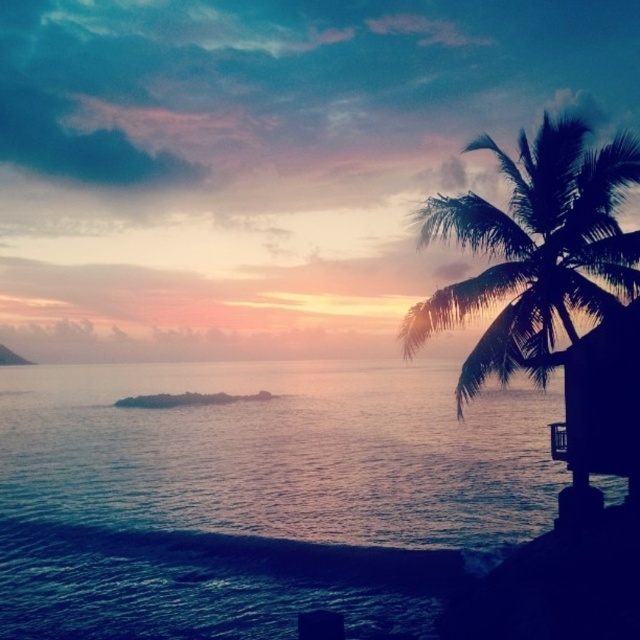
Is blue water at center above silhouette leafy palm at right?

Incorrect, blue water at center is not positioned above silhouette leafy palm at right.

Image resolution: width=640 pixels, height=640 pixels. Identify the location of blue water at center. (252, 492).

Find the location of a particular element. This screenshot has height=640, width=640. blue water at center is located at coordinates (252, 492).

Between silhouette leafy palm at right and dark brown wooden hut at right, which one has less height?

With less height is dark brown wooden hut at right.

Between point (589, 352) and point (554, 449), which one is positioned behind?

Point (554, 449)

Is point (618, 188) positioned in front of point (627, 380)?

That is False.

Image resolution: width=640 pixels, height=640 pixels. What are the coordinates of `silhouette leafy palm at right` in the screenshot? It's located at (552, 292).

Can you confirm if blue water at center is positioned above dark brown wooden hut at right?

No.

Based on the photo, measure the distance between blue water at center and camera.

They are 17.83 meters apart.

Measure the distance between point (140,452) and camera.

Point (140,452) is 47.77 meters from camera.

Identify the location of blue water at center. (252, 492).